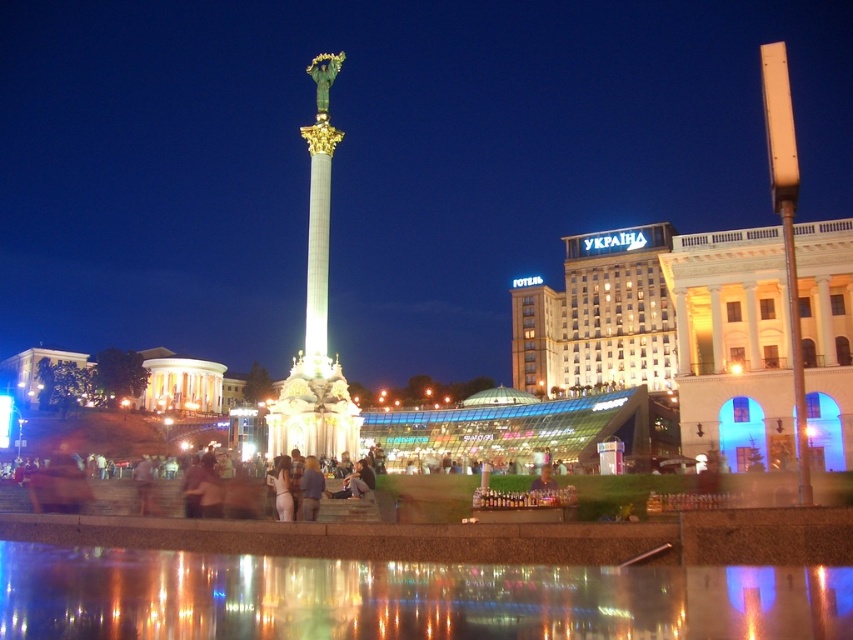
Can you confirm if transparent glass water at lower center is smaller than blue denim jeans at center?

No.

Is the position of transparent glass water at lower center more distant than that of blue denim jeans at center?

No, it is in front of blue denim jeans at center.

Is point (460, 572) positioned behind point (312, 477)?

No, (460, 572) is closer to viewer.

Find the location of a particular element. transparent glass water at lower center is located at coordinates (403, 598).

This screenshot has height=640, width=853. What do you see at coordinates (316, 312) in the screenshot?
I see `shiny gold column at center` at bounding box center [316, 312].

The image size is (853, 640). In order to click on shiny gold column at center in this screenshot , I will do `click(316, 312)`.

Is transparent glass water at lower center taller than smooth skin face at center?

No.

Locate an element on the screen. This screenshot has height=640, width=853. transparent glass water at lower center is located at coordinates (403, 598).